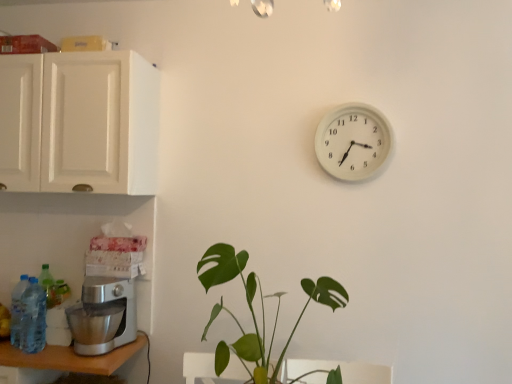
Where is `free location in front of translucent plastic bottle at lower left, the 1th bottle from the left`? The height and width of the screenshot is (384, 512). free location in front of translucent plastic bottle at lower left, the 1th bottle from the left is located at coordinates (15, 354).